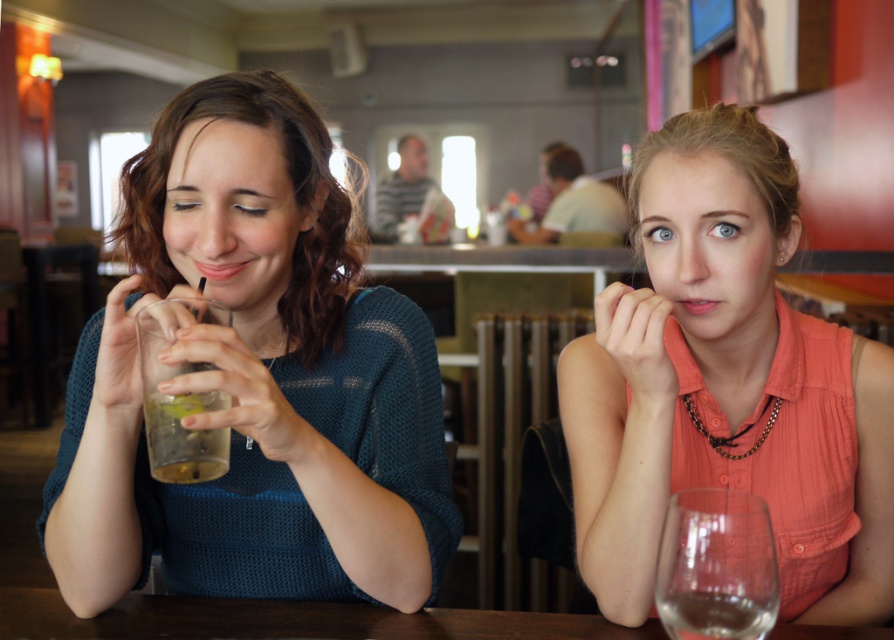
Question: Which point is closer to the camera?

Choices:
 (A) (746, 314)
 (B) (675, 621)
 (C) (721, 448)
 (D) (97, 433)

Answer: (B)

Question: Does transparent glass at lower right have a lesser width compared to clear glass at left?

Choices:
 (A) yes
 (B) no

Answer: (B)

Question: Which of the following is the farthest from the observer?

Choices:
 (A) matte orange blouse at center
 (B) translucent plastic cup at left
 (C) transparent glass at lower right

Answer: (A)

Question: Which point appears farthest from the camera in this image?

Choices:
 (A) (852, 486)
 (B) (186, 442)
 (C) (356, 556)
 (D) (319, 616)

Answer: (A)

Question: Can you confirm if matte orange blouse at center is positioned to the left of transparent glass at lower right?

Choices:
 (A) no
 (B) yes

Answer: (A)

Question: Is brown wooden table at center in front of clear glass wine at right?

Choices:
 (A) no
 (B) yes

Answer: (A)